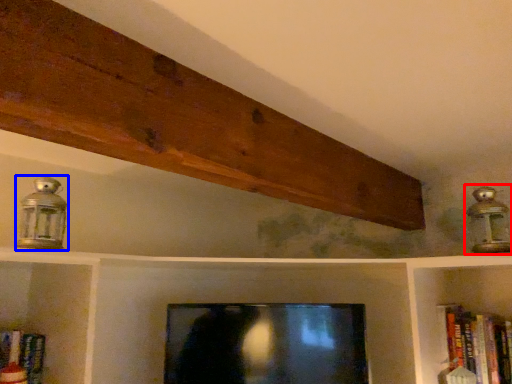
Question: Among these objects, which one is farthest to the camera, lamp (highlighted by a red box) or lamp (highlighted by a blue box)?

Choices:
 (A) lamp
 (B) lamp

Answer: (A)